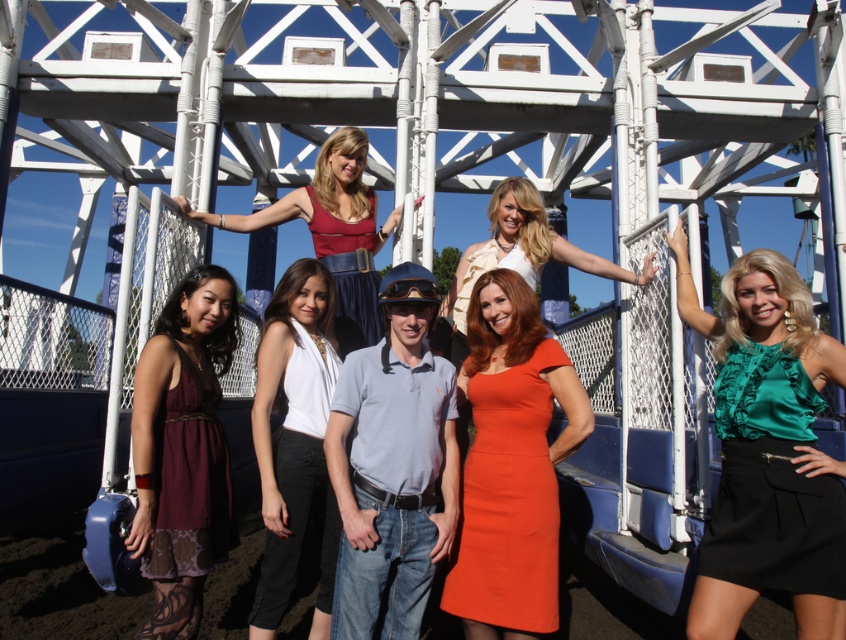
Is burgundy satin dress at lower left positioned before matte red dress at center?

Yes, it is.

Can you confirm if burgundy satin dress at lower left is shorter than matte red dress at center?

Yes, burgundy satin dress at lower left is shorter than matte red dress at center.

Between point (190, 440) and point (365, 156), which one is positioned behind?

The point (365, 156) is more distant.

Locate an element on the screen. This screenshot has height=640, width=846. burgundy satin dress at lower left is located at coordinates (190, 476).

In the scene shown: Which is more to the left, burgundy satin dress at lower left or white satin dress at center?

burgundy satin dress at lower left is more to the left.

Can you confirm if burgundy satin dress at lower left is wider than white satin dress at center?

No, burgundy satin dress at lower left is not wider than white satin dress at center.

The image size is (846, 640). What do you see at coordinates (190, 476) in the screenshot?
I see `burgundy satin dress at lower left` at bounding box center [190, 476].

You are a GUI agent. You are given a task and a screenshot of the screen. Output one action in this format:
    pyautogui.click(x=<x>, y=<y>)
    Task: Click on the burgundy satin dress at lower left
    This screenshot has width=846, height=640.
    Given the screenshot: What is the action you would take?
    pyautogui.click(x=190, y=476)

Who is positioned more to the left, white satin blouse at center or white satin dress at center?

From the viewer's perspective, white satin blouse at center appears more on the left side.

Between point (316, 387) and point (531, 221), which one is positioned behind?

Positioned behind is point (531, 221).

Find the location of a particular element. white satin blouse at center is located at coordinates [294, 438].